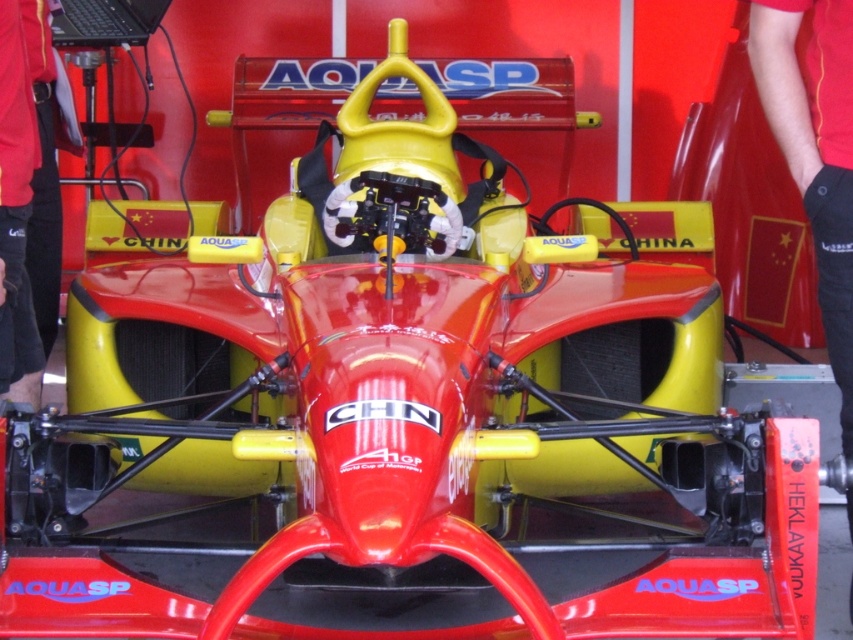
You are a race car driver preparing to enter the cockpit of the Formula One car. You have a red cotton shirt at center. Where should you place your hand to put on the shirt?

The red cotton shirt at center is located at point [815,150], so you should reach towards that coordinate to put on the shirt.

You are a race car driver preparing to enter the cockpit of the Formula One car. You have two items in your inventory, the red cotton shirt at center and the red fabric pants at lower left. Which item should you put on first based on their sizes?

The red cotton shirt at center has a larger size compared to the red fabric pants at lower left, so you should put on the red cotton shirt at center first because larger items are typically put on before smaller ones to avoid clothing underneath being covered or restricted.